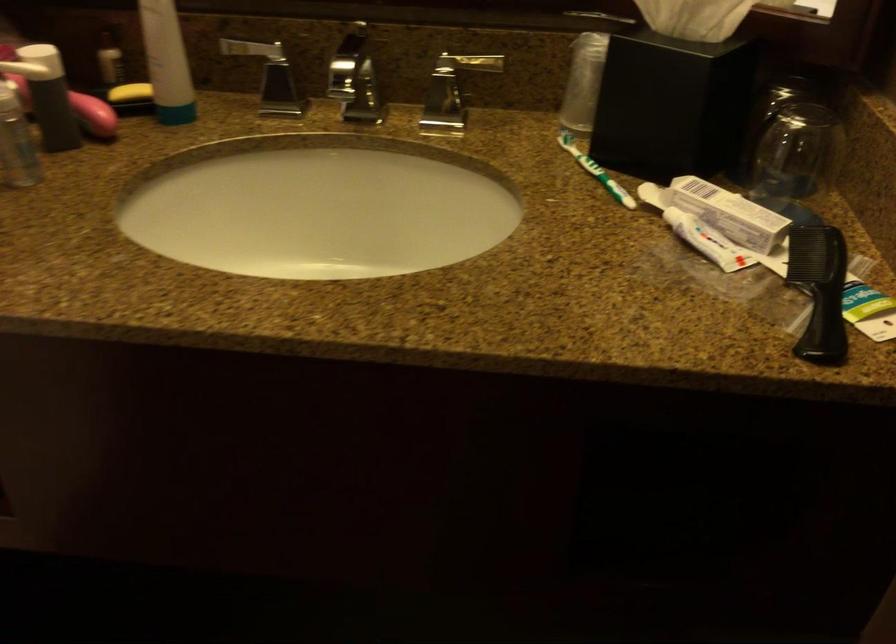
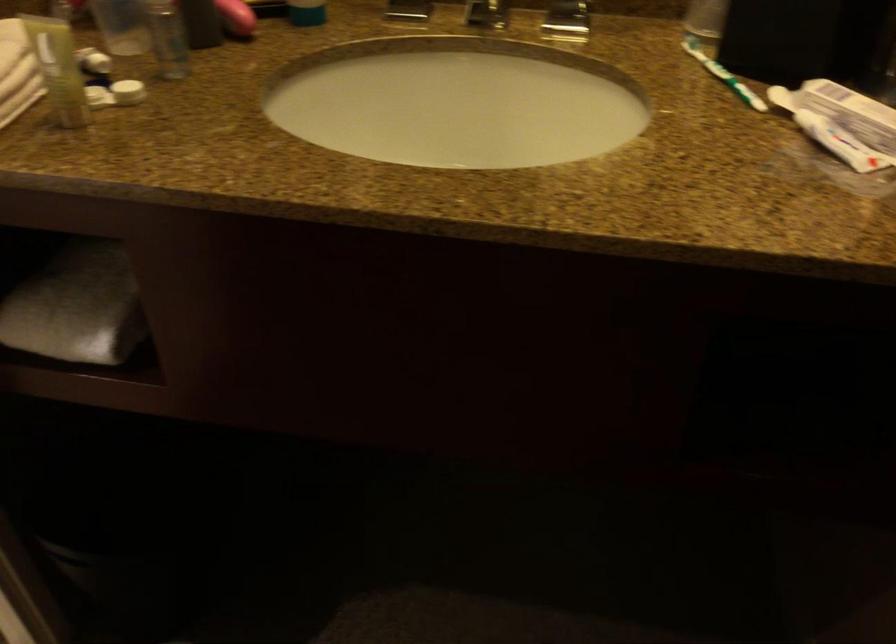
Question: The images are taken continuously from a first-person perspective. In which direction is your viewpoint rotating?

Choices:
 (A) Left
 (B) Right
 (C) Up
 (D) Down

Answer: (A)